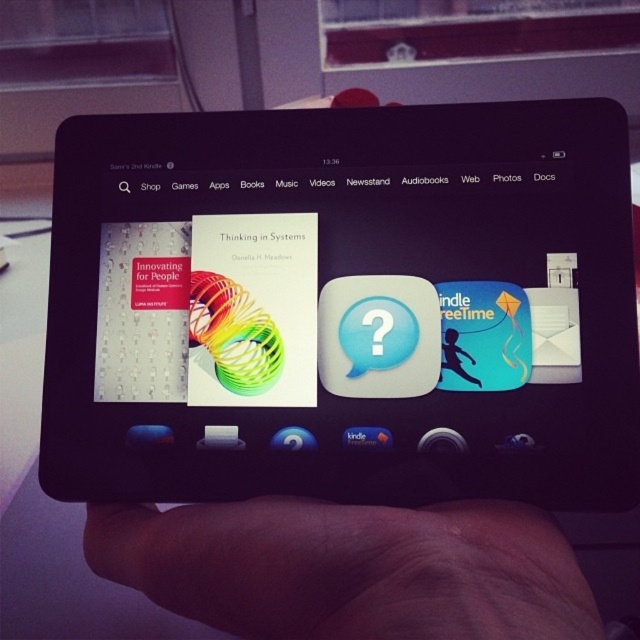
Question: Is black glossy tablet at center smaller than skinny flesh at lower center?

Choices:
 (A) yes
 (B) no

Answer: (B)

Question: Is black glossy tablet at center to the left of skinny flesh at lower center from the viewer's perspective?

Choices:
 (A) no
 (B) yes

Answer: (A)

Question: Which of the following is the closest to the observer?

Choices:
 (A) (124, 397)
 (B) (406, 589)

Answer: (B)

Question: Does black glossy tablet at center appear on the right side of skinny flesh at lower center?

Choices:
 (A) no
 (B) yes

Answer: (B)